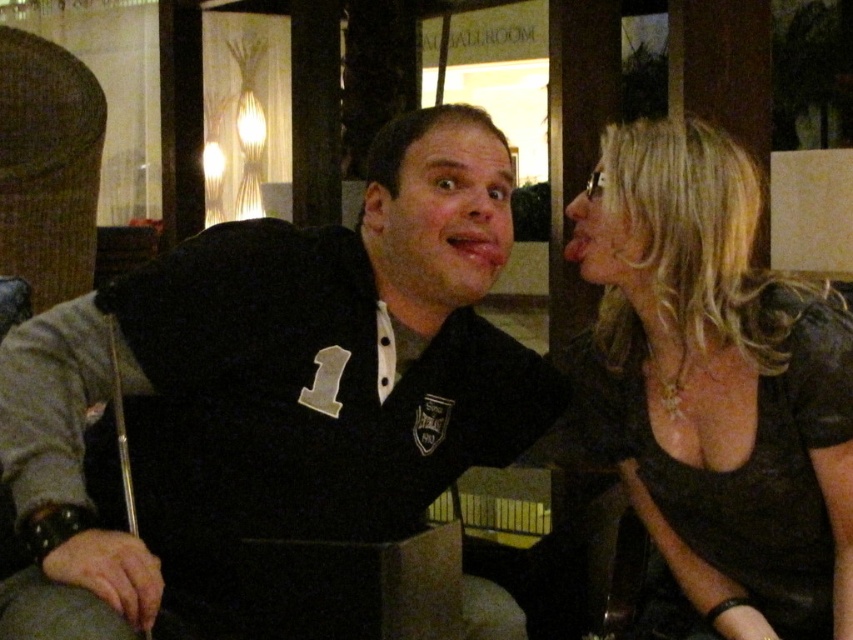
From the picture: Is matte black face at center to the right of smooth skin face at upper right from the viewer's perspective?

No, matte black face at center is not to the right of smooth skin face at upper right.

Describe the element at coordinates (442, 216) in the screenshot. This screenshot has width=853, height=640. I see `matte black face at center` at that location.

At what (x,y) coordinates should I click in order to perform the action: click on matte black face at center. Please return your answer as a coordinate pair (x, y). Looking at the image, I should click on click(442, 216).

Can you confirm if black jersey at center is positioned to the right of smooth skin face at upper right?

No, black jersey at center is not to the right of smooth skin face at upper right.

Describe the element at coordinates (270, 388) in the screenshot. Image resolution: width=853 pixels, height=640 pixels. I see `black jersey at center` at that location.

Who is more forward, (410,298) or (572,227)?

Point (410,298) is in front.

This screenshot has height=640, width=853. I want to click on black jersey at center, so click(270, 388).

Is shiny black dress at right bigger than smooth skin face at upper right?

Indeed, shiny black dress at right has a larger size compared to smooth skin face at upper right.

Who is more distant from viewer, (x=689, y=422) or (x=630, y=227)?

The point (x=689, y=422) is behind.

Who is more forward, (637, 124) or (604, 250)?

Positioned in front is point (604, 250).

What are the coordinates of `shiny black dress at right` in the screenshot? It's located at (717, 385).